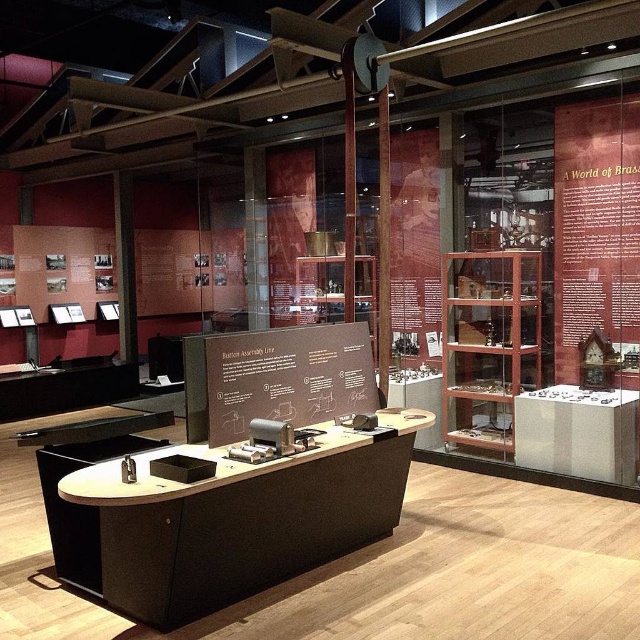
Is point (616, 280) farther from camera compared to point (269, 406)?

Yes.

Between brown paper at upper right and brown matte signboard at center, which one has more height?

With more height is brown paper at upper right.

Image resolution: width=640 pixels, height=640 pixels. Describe the element at coordinates (595, 227) in the screenshot. I see `brown paper at upper right` at that location.

Locate an element on the screen. This screenshot has width=640, height=640. brown paper at upper right is located at coordinates (595, 227).